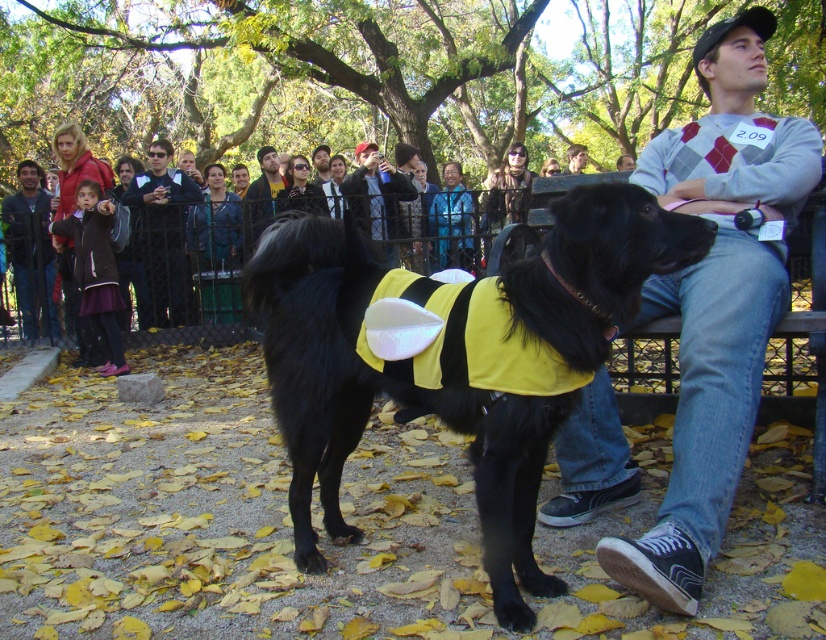
You are a photographer trying to capture a clear shot of the black leather jacket at center and the dark brown leather jacket at left. Which jacket is wider so you can adjust your camera angle accordingly?

The dark brown leather jacket at left is wider than the black leather jacket at center, so you should adjust your camera angle to account for its greater width.

You are a photographer at the park and want to capture both the yellow fabric dog at center and the black leather jacket at center in a single shot. Which object should you focus on first to ensure both are in frame?

The yellow fabric dog at center is located below the black leather jacket at center, so you should focus on the black leather jacket at center first to ensure both are in frame.

You are a photographer at the park and notice two jackets in the scene. The black leather jacket at center and the dark brown leather jacket at left. Which jacket is closer to the camera?

The dark brown leather jacket at left is behind the black leather jacket at center, so the black leather jacket at center is closer to the camera.